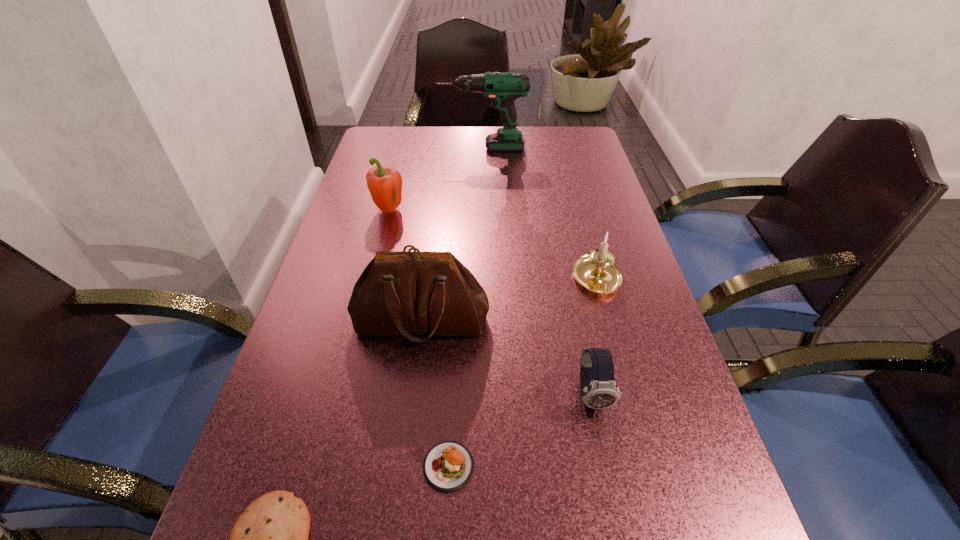
You are a GUI agent. You are given a task and a screenshot of the screen. Output one action in this format:
    pyautogui.click(x=<x>, y=<y>)
    Task: Click on the blank space located on the handle side of the tallest object
    This screenshot has width=960, height=540.
    Given the screenshot: What is the action you would take?
    pyautogui.click(x=425, y=148)

Locate an element on the screen. This screenshot has width=960, height=540. vacant area located on the right of the shoulder bag is located at coordinates (575, 321).

The height and width of the screenshot is (540, 960). I want to click on vacant space located 0.130m on the front of the pepper, so click(x=378, y=255).

The width and height of the screenshot is (960, 540). In order to click on blank space located on the handle side of the fourth shortest object in this screenshot , I will do 617,354.

This screenshot has height=540, width=960. I want to click on vacant space located 0.150m on the face of the watch, so click(615, 511).

This screenshot has height=540, width=960. I want to click on free spot located on the back of the shortest object, so click(x=455, y=345).

This screenshot has height=540, width=960. I want to click on object that is positioned at the far edge, so click(x=502, y=88).

What are the coordinates of `shoulder bag present at the left edge` in the screenshot? It's located at click(x=409, y=293).

Locate an element on the screen. The width and height of the screenshot is (960, 540). pepper positioned at the left edge is located at coordinates (385, 184).

Where is `candle holder located at the right edge`? Image resolution: width=960 pixels, height=540 pixels. candle holder located at the right edge is located at coordinates (597, 272).